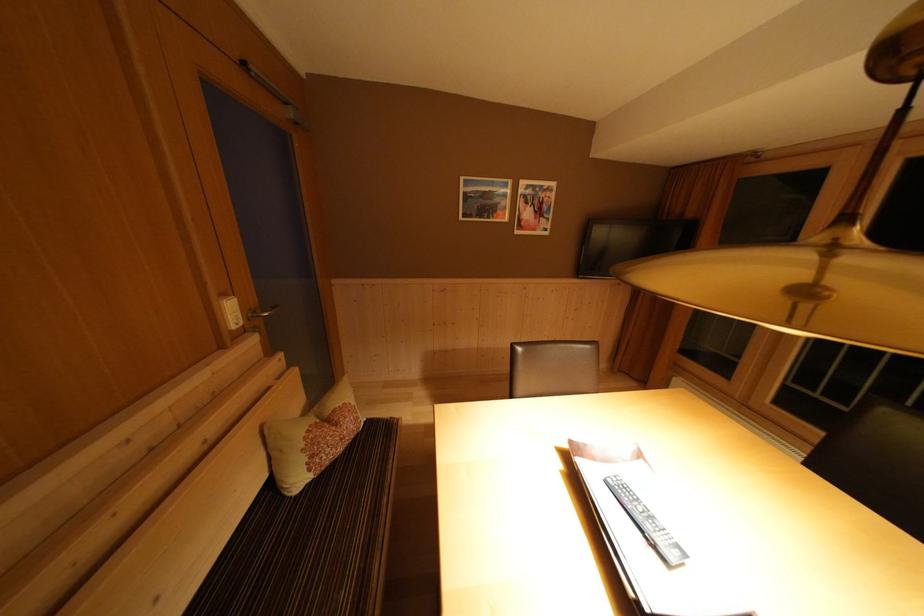
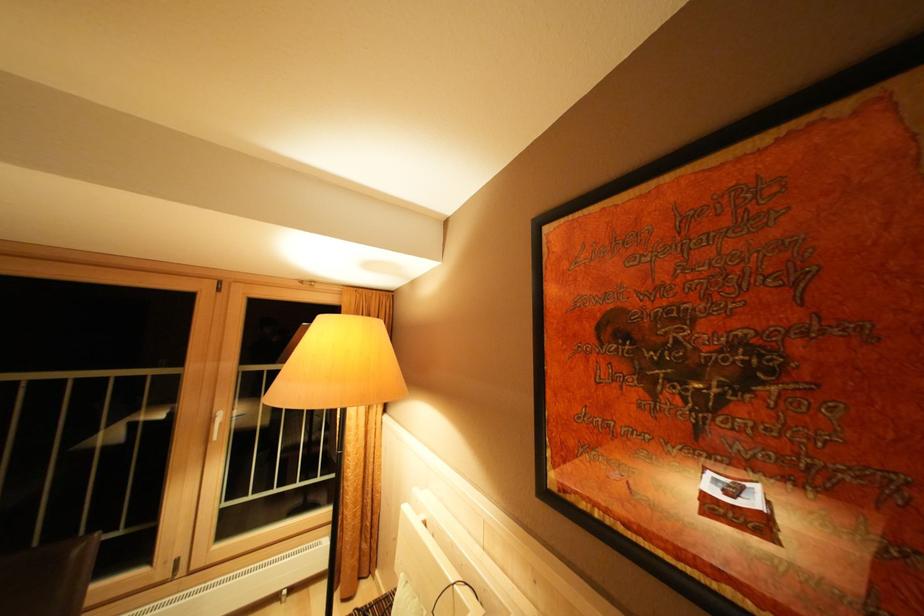
Question: The first image is from the beginning of the video and the second image is from the end. How did the camera likely rotate when shooting the video?

Choices:
 (A) Left
 (B) Right
 (C) Up
 (D) Down

Answer: (B)